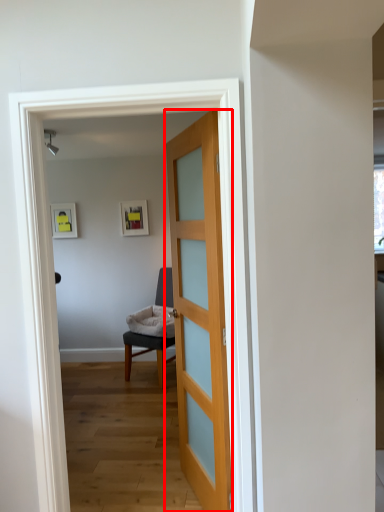
Question: From the image's perspective, what is the correct spatial relationship of door (annotated by the red box) in relation to chair?

Choices:
 (A) below
 (B) above

Answer: (B)